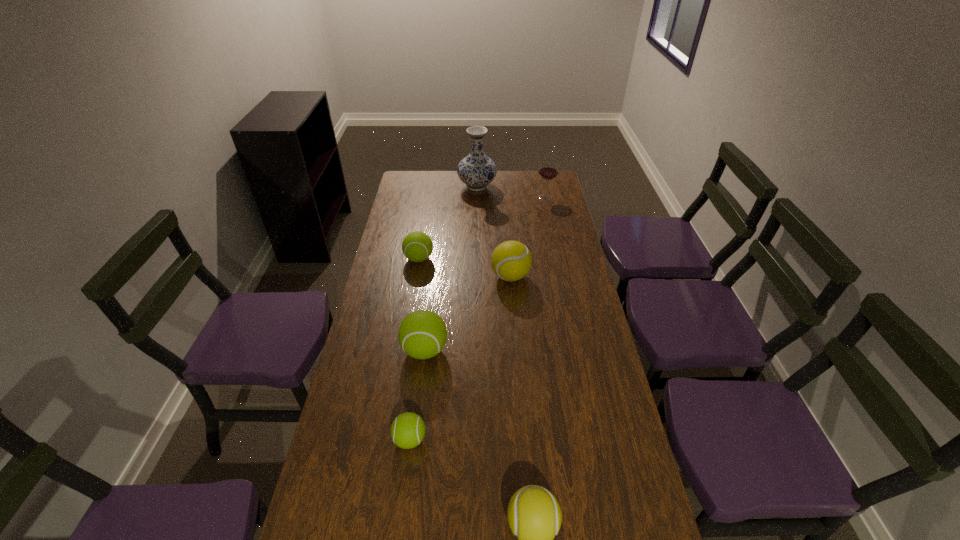
Identify the location of free spot between the farther yellow tennis ball and the vase. (493, 232).

Locate an element on the screen. This screenshot has width=960, height=540. the fourth closest object to the farthest green tennis ball is located at coordinates click(x=548, y=170).

You are a GUI agent. You are given a task and a screenshot of the screen. Output one action in this format:
    pyautogui.click(x=<x>, y=<y>)
    Task: Click on the object that stands as the sixth closest to the shortest object
    Image resolution: width=960 pixels, height=540 pixels.
    Given the screenshot: What is the action you would take?
    pyautogui.click(x=548, y=170)

Identify the location of tennis ball that can be found as the fourth closest to the nearer yellow tennis ball. This screenshot has height=540, width=960. (417, 246).

In order to click on tennis ball that is the fourth closest one to the red wineglass in this screenshot , I will do `click(407, 431)`.

Locate an element on the screen. the second closest yellow tennis ball to the farthest green tennis ball is located at coordinates (534, 515).

Find the location of `the closest green tennis ball to the second smallest green tennis ball`. the closest green tennis ball to the second smallest green tennis ball is located at coordinates (422, 334).

Identify which green tennis ball is the closest to the wineglass. Please provide its 2D coordinates. Your answer should be formatted as a tuple, i.e. [(x, y)], where the tuple contains the x and y coordinates of a point satisfying the conditions above.

[(417, 246)]

This screenshot has width=960, height=540. Find the location of `free space that satisfies the following two spatial constraints: 1. on the front side of the second biggest green tennis ball; 2. on the right side of the farther yellow tennis ball`. free space that satisfies the following two spatial constraints: 1. on the front side of the second biggest green tennis ball; 2. on the right side of the farther yellow tennis ball is located at coordinates (416, 276).

Locate an element on the screen. The image size is (960, 540). vacant space that satisfies the following two spatial constraints: 1. on the back side of the vase; 2. on the right side of the biggest green tennis ball is located at coordinates (444, 186).